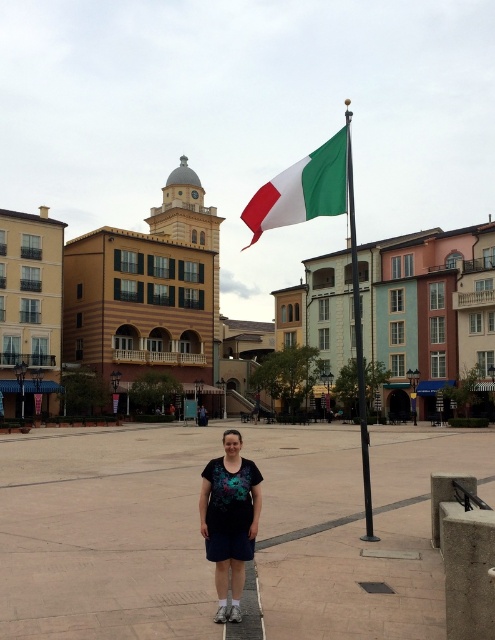
Who is positioned more to the right, dark blue cotton dress at center or white-green fabric flag at upper center?

Positioned to the right is white-green fabric flag at upper center.

Does point (241, 556) come in front of point (316, 198)?

Yes, it is.

Locate an element on the screen. The height and width of the screenshot is (640, 495). dark blue cotton dress at center is located at coordinates (230, 520).

Who is positioned more to the right, white-green fabric flag at upper center or green matte flagpole at center?

green matte flagpole at center is more to the right.

Does white-green fabric flag at upper center have a smaller size compared to green matte flagpole at center?

Correct, white-green fabric flag at upper center occupies less space than green matte flagpole at center.

Is point (300, 220) positioned before point (359, 385)?

That is True.

Find the location of `white-green fabric flag at upper center`. white-green fabric flag at upper center is located at coordinates (302, 189).

Is the position of green matte flagpole at center less distant than that of black metal square at center?

No, it is not.

What do you see at coordinates (357, 333) in the screenshot?
I see `green matte flagpole at center` at bounding box center [357, 333].

Does point (348, 132) lie behind point (364, 586)?

That is True.

Image resolution: width=495 pixels, height=640 pixels. Find the location of `green matte flagpole at center`. green matte flagpole at center is located at coordinates (357, 333).